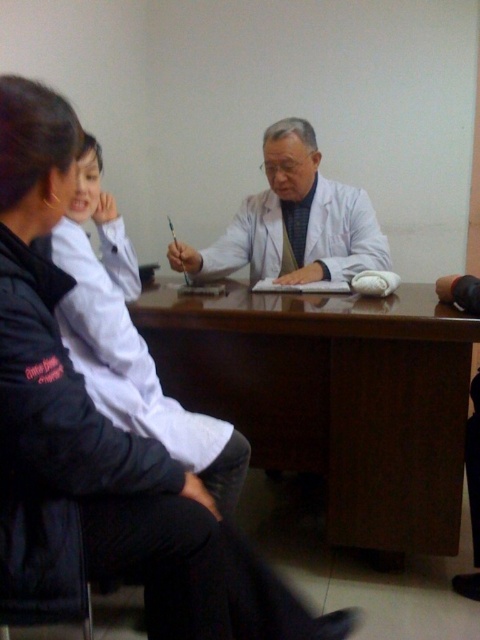
Describe the element at coordinates (334, 397) in the screenshot. I see `brown wood table at center` at that location.

Does brown wood table at center come in front of white matte coat at left?

No, it is behind white matte coat at left.

Which is behind, point (212, 353) or point (76, 211)?

Positioned behind is point (212, 353).

Image resolution: width=480 pixels, height=640 pixels. What are the coordinates of `brown wood table at center` in the screenshot? It's located at (334, 397).

Between white matte coat at left and white matte coat at center, which one is positioned higher?

Positioned higher is white matte coat at center.

In the scene shown: Can you confirm if white matte coat at left is shorter than white matte coat at center?

Incorrect, white matte coat at left's height does not fall short of white matte coat at center's.

Between point (82, 310) and point (291, 276), which one is positioned in front?

Point (82, 310)

At what (x,y) coordinates should I click in order to perform the action: click on white matte coat at left. Please return your answer as a coordinate pair (x, y). Image resolution: width=480 pixels, height=640 pixels. Looking at the image, I should click on tap(131, 340).

Who is positioned more to the right, brown wood table at center or white matte coat at center?

brown wood table at center is more to the right.

Which is below, brown wood table at center or white matte coat at center?

Positioned lower is brown wood table at center.

Is point (330, 502) positioned before point (294, 177)?

Yes, point (330, 502) is in front of point (294, 177).

Find the location of a particular element. brown wood table at center is located at coordinates (334, 397).